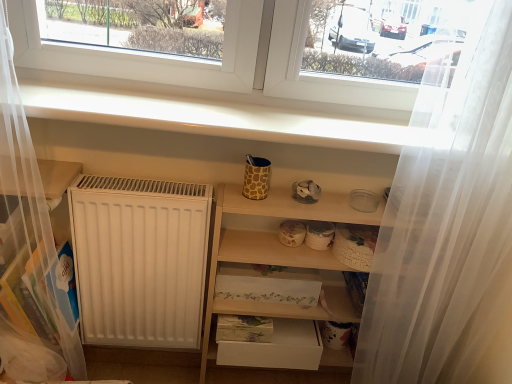
This screenshot has width=512, height=384. Describe the element at coordinates (277, 255) in the screenshot. I see `wooden shelves at center` at that location.

Where is `wooden shelves at center`? The image size is (512, 384). wooden shelves at center is located at coordinates (277, 255).

Is white matte drawer at lower center facing away from white smooth window sill at upper center?

No.

Locate an element on the screen. The height and width of the screenshot is (384, 512). drawer on the right of the white smooth window sill at upper center is located at coordinates (277, 348).

Between white matte drawer at lower center and white smooth window sill at upper center, which one has larger size?

Bigger between the two is white smooth window sill at upper center.

Is white sheer curtain at right wider or thinner than wooden shelves at center?

In the image, white sheer curtain at right appears to be more narrow than wooden shelves at center.

From the image's perspective, does white sheer curtain at right appear higher than wooden shelves at center?

Correct, white sheer curtain at right appears higher than wooden shelves at center in the image.

Does point (465, 165) come farther from viewer compared to point (278, 194)?

No.

Where is `window sill above the wooden shelves at center (from a real-world perspective)`? This screenshot has width=512, height=384. window sill above the wooden shelves at center (from a real-world perspective) is located at coordinates (212, 118).

How different are the orientations of wooden shelves at center and white smooth window sill at upper center in degrees?

There is a 0.435-degree angle between the facing directions of wooden shelves at center and white smooth window sill at upper center.

How distant is wooden shelves at center from white smooth window sill at upper center?

They are 14.28 inches apart.

Can you confirm if wooden shelves at center is positioned to the right of white smooth window sill at upper center?

Correct, you'll find wooden shelves at center to the right of white smooth window sill at upper center.

Between white sheer curtain at right and white smooth window sill at upper center, which one appears on the right side from the viewer's perspective?

From the viewer's perspective, white sheer curtain at right appears more on the right side.

Considering their positions, is white sheer curtain at right located in front of or behind white smooth window sill at upper center?

white sheer curtain at right is in front of white smooth window sill at upper center.

Considering the sizes of objects white sheer curtain at right and white smooth window sill at upper center in the image provided, who is smaller, white sheer curtain at right or white smooth window sill at upper center?

Smaller between the two is white smooth window sill at upper center.

Is point (181, 131) closer or farther from the camera than point (383, 368)?

Point (181, 131) is closer to the camera than point (383, 368).

Who is shorter, white smooth window sill at upper center or white sheer curtain at right?

white smooth window sill at upper center.

From a real-world perspective, is white smooth window sill at upper center physically located above or below white sheer curtain at right?

Clearly, from a real-world perspective, white smooth window sill at upper center is above white sheer curtain at right.

How much distance is there between white smooth window sill at upper center and white sheer curtain at right?

A distance of 16.11 inches exists between white smooth window sill at upper center and white sheer curtain at right.

In terms of height, does white matte drawer at lower center look taller or shorter compared to wooden shelves at center?

white matte drawer at lower center is shorter than wooden shelves at center.

Measure the distance between white matte drawer at lower center and wooden shelves at center.

white matte drawer at lower center and wooden shelves at center are 7.60 inches apart.

Would you say white matte drawer at lower center is a long distance from wooden shelves at center?

No, there isn't a large distance between white matte drawer at lower center and wooden shelves at center.

Which is in front, point (271, 358) or point (304, 314)?

The point (304, 314) is more forward.

Is white sheer curtain at right directly adjacent to white matte drawer at lower center?

No, white sheer curtain at right is not in contact with white matte drawer at lower center.

Does white sheer curtain at right have a lesser height compared to white matte drawer at lower center?

No.

Which of these two, white sheer curtain at right or white matte drawer at lower center, is thinner?

white matte drawer at lower center is thinner.

Locate an element on the screen. The height and width of the screenshot is (384, 512). window sill that is on the left side of white matte drawer at lower center is located at coordinates (212, 118).

Find the location of a particular element. shower curtain on the right side of wooden shelves at center is located at coordinates (446, 224).

Estimate the real-world distances between objects in this image. Which object is closer to white matte drawer at lower center, wooden shelves at center or white sheer curtain at right?

wooden shelves at center.

When comparing their distances from white smooth window sill at upper center, does wooden shelves at center or white matte drawer at lower center seem further?

Among the two, white matte drawer at lower center is located further to white smooth window sill at upper center.

Based on their spatial positions, is white matte drawer at lower center or wooden shelves at center closer to white smooth window sill at upper center?

Based on the image, wooden shelves at center appears to be nearer to white smooth window sill at upper center.

Based on the photo, from the image, which object appears to be nearer to white matte drawer at lower center, white sheer curtain at right or white smooth window sill at upper center?

Based on the image, white sheer curtain at right appears to be nearer to white matte drawer at lower center.

Estimate the real-world distances between objects in this image. Which object is closer to white sheer curtain at right, white smooth window sill at upper center or wooden shelves at center?

wooden shelves at center is closer to white sheer curtain at right.

From the image, which object appears to be nearer to white sheer curtain at right, wooden shelves at center or white smooth window sill at upper center?

wooden shelves at center is closer to white sheer curtain at right.

Looking at the image, which one is located closer to white matte drawer at lower center, white sheer curtain at right or wooden shelves at center?

wooden shelves at center.

Which object lies further to the anchor point white smooth window sill at upper center, white matte drawer at lower center or white sheer curtain at right?

white matte drawer at lower center lies further to white smooth window sill at upper center than the other object.

Locate an element on the screen. This screenshot has height=384, width=512. shower curtain between white smooth window sill at upper center and white matte drawer at lower center from top to bottom is located at coordinates (446, 224).

Locate an element on the screen. Image resolution: width=512 pixels, height=384 pixels. shelf between white smooth window sill at upper center and white matte drawer at lower center vertically is located at coordinates (277, 255).

You are a GUI agent. You are given a task and a screenshot of the screen. Output one action in this format:
    pyautogui.click(x=<x>, y=<y>)
    Task: Click on the shower curtain between white smooth window sill at upper center and wooden shelves at center in the up-down direction
    Image resolution: width=512 pixels, height=384 pixels.
    Given the screenshot: What is the action you would take?
    pyautogui.click(x=446, y=224)

At what (x,y) coordinates should I click in order to perform the action: click on shelf positioned between white sheer curtain at right and white matte drawer at lower center from near to far. Please return your answer as a coordinate pair (x, y). The height and width of the screenshot is (384, 512). Looking at the image, I should click on (277, 255).